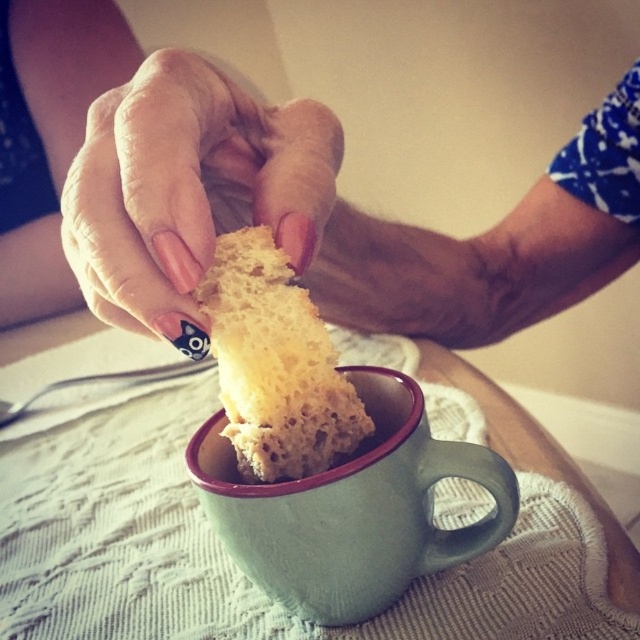
Question: Which object appears closest to the camera in this image?

Choices:
 (A) matte white bread at upper center
 (B) spongy yellow bread at center
 (C) nail polish painted fingernails at upper center
 (D) green matte mug at center

Answer: (C)

Question: Among these objects, which one is farthest from the camera?

Choices:
 (A) matte white bread at upper center
 (B) spongy yellow bread at center
 (C) nail polish painted fingernails at upper center

Answer: (B)

Question: Considering the real-world distances, which object is farthest from the green matte mug at center?

Choices:
 (A) spongy yellow bread at center
 (B) matte white bread at upper center
 (C) nail polish painted fingernails at upper center

Answer: (B)

Question: Does matte white bread at upper center appear on the right side of green matte mug at center?

Choices:
 (A) no
 (B) yes

Answer: (B)

Question: Is matte white bread at upper center further to camera compared to green matte mug at center?

Choices:
 (A) yes
 (B) no

Answer: (B)

Question: Is matte white bread at upper center behind nail polish painted fingernails at upper center?

Choices:
 (A) yes
 (B) no

Answer: (A)